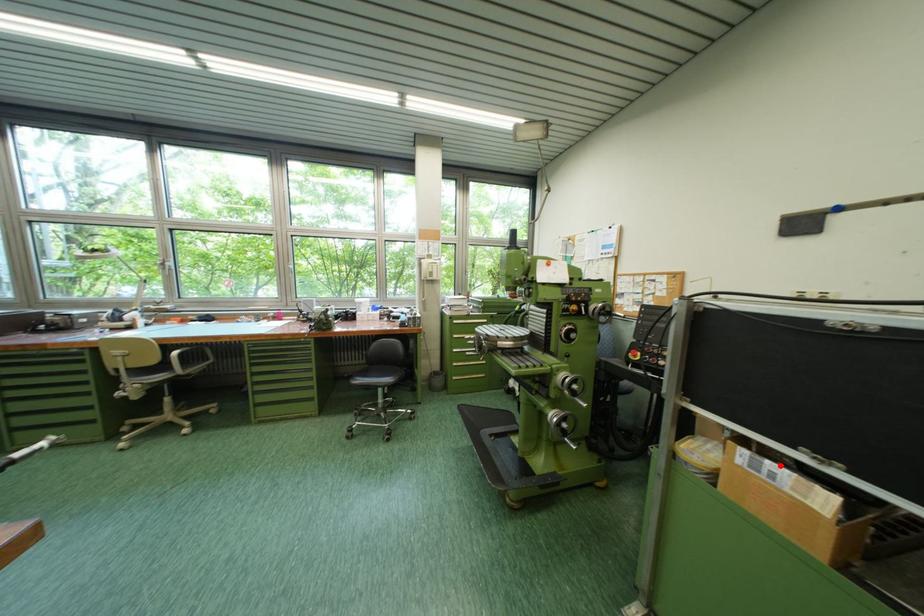
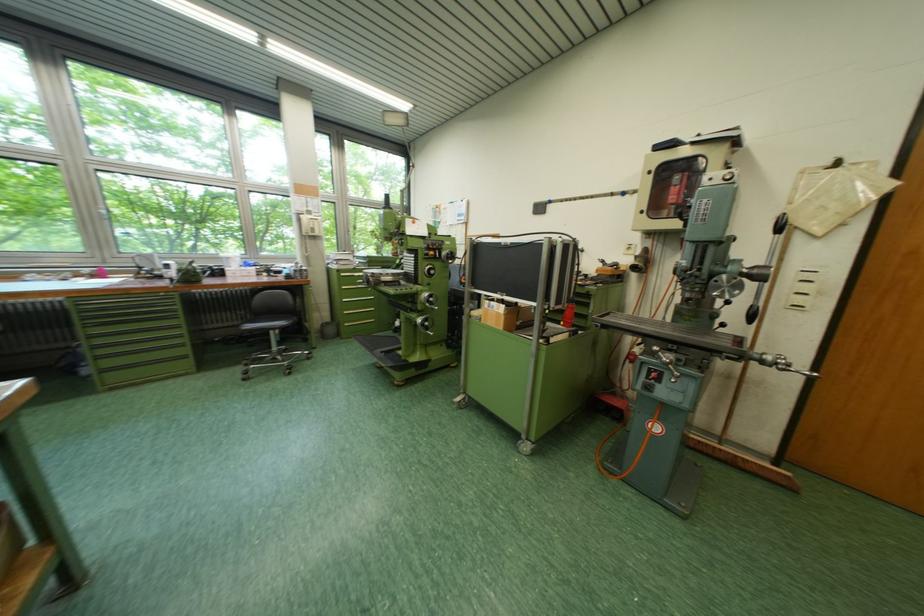
Where in the second image is the point corresponding to the highlighted location from the first image?

(503, 305)